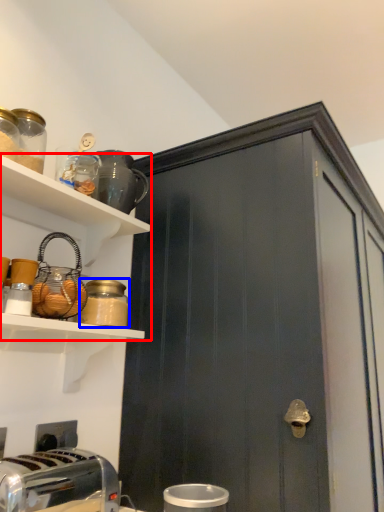
Question: Which object appears farthest to the camera in this image, shelf (highlighted by a red box) or bottle (highlighted by a blue box)?

Choices:
 (A) shelf
 (B) bottle

Answer: (B)